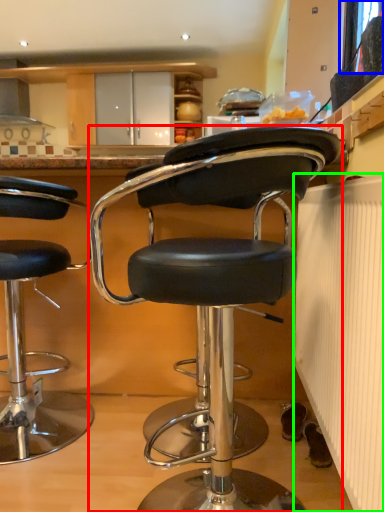
Question: Which object is the closest to the chair (highlighted by a red box)? Choose among these: window screen (highlighted by a blue box) or radiator (highlighted by a green box).

Choices:
 (A) window screen
 (B) radiator

Answer: (B)